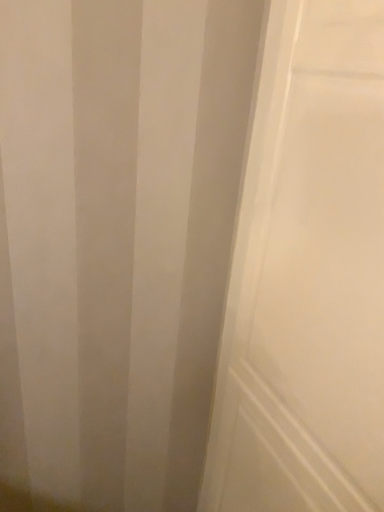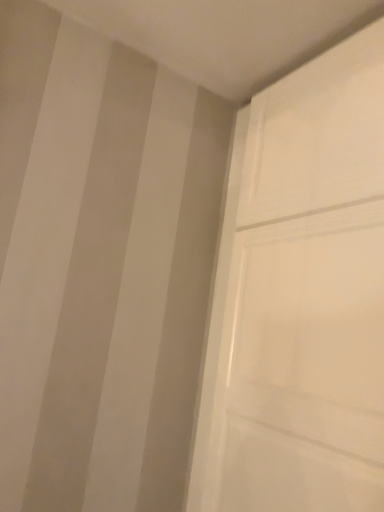
Question: Which way did the camera rotate in the video?

Choices:
 (A) rotated upward
 (B) rotated downward

Answer: (A)